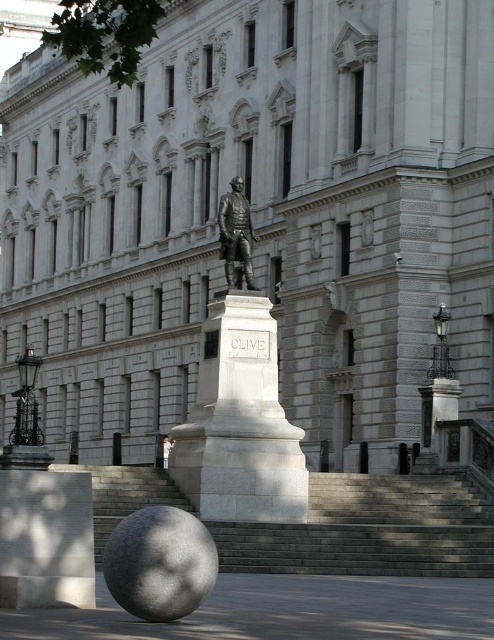
Question: Does bronze statue at center appear under white marble statue at center?

Choices:
 (A) yes
 (B) no

Answer: (B)

Question: Is polished bronze statue at center behind white marble statue at center?

Choices:
 (A) no
 (B) yes

Answer: (A)

Question: Which is farther from the polished bronze statue at center?

Choices:
 (A) bronze statue at center
 (B) white marble statue at center

Answer: (B)

Question: Which point appears farthest from the camera in this image?

Choices:
 (A) (385, 477)
 (B) (230, 216)
 (C) (166, 452)

Answer: (C)

Question: Which of the following is the closest to the observer?

Choices:
 (A) gray stone stairs at center
 (B) bronze statue at center
 (C) polished bronze statue at center
 (D) white marble statue at center

Answer: (A)

Question: Does gray stone stairs at center appear under bronze statue at center?

Choices:
 (A) no
 (B) yes

Answer: (B)